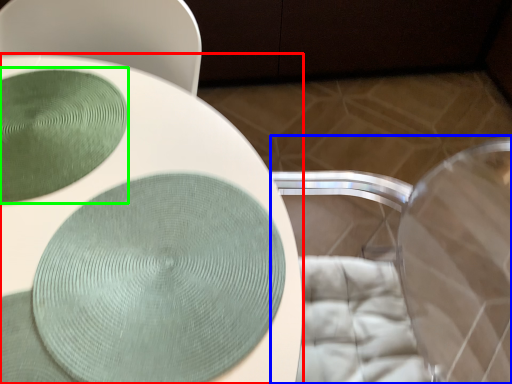
Question: Considering the real-world distances, which object is closest to toilet (highlighted by a red box)? swivel chair (highlighted by a blue box) or glass plate (highlighted by a green box).

Choices:
 (A) swivel chair
 (B) glass plate

Answer: (B)